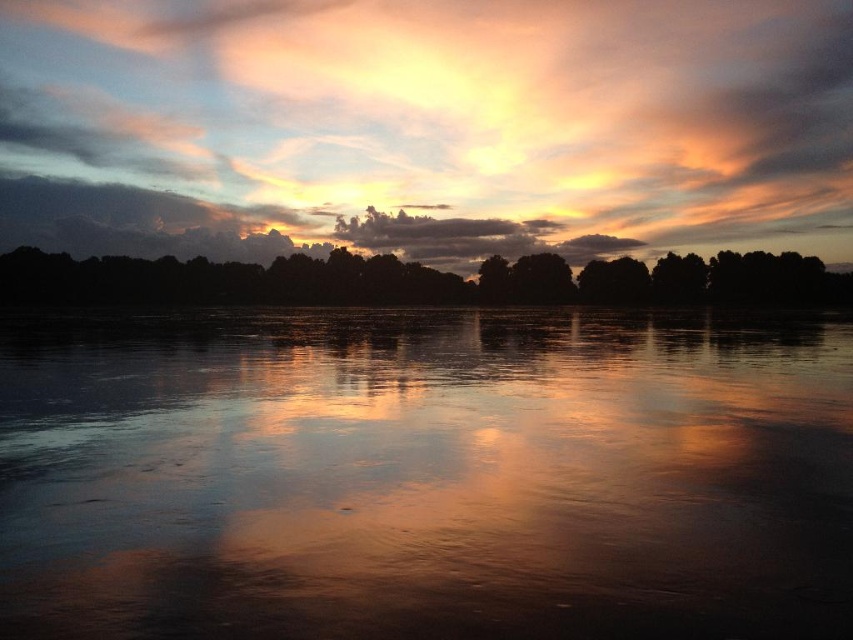
Question: Is smooth reflective water at center further to the viewer compared to cloudy sky at upper center?

Choices:
 (A) yes
 (B) no

Answer: (B)

Question: Among these points, which one is nearest to the camera?

Choices:
 (A) (434, 205)
 (B) (280, 264)

Answer: (B)

Question: Which point appears farthest from the camera in this image?

Choices:
 (A) (68, 280)
 (B) (589, 509)
 (C) (488, 218)

Answer: (C)

Question: Does smooth reflective water at center have a smaller size compared to cloudy sky at upper center?

Choices:
 (A) no
 (B) yes

Answer: (B)

Question: Does smooth reflective water at center appear under cloudy sky at upper center?

Choices:
 (A) no
 (B) yes

Answer: (B)

Question: Considering the real-world distances, which object is closest to the smooth reflective water at center?

Choices:
 (A) silhouette trees at center
 (B) cloudy sky at upper center

Answer: (A)